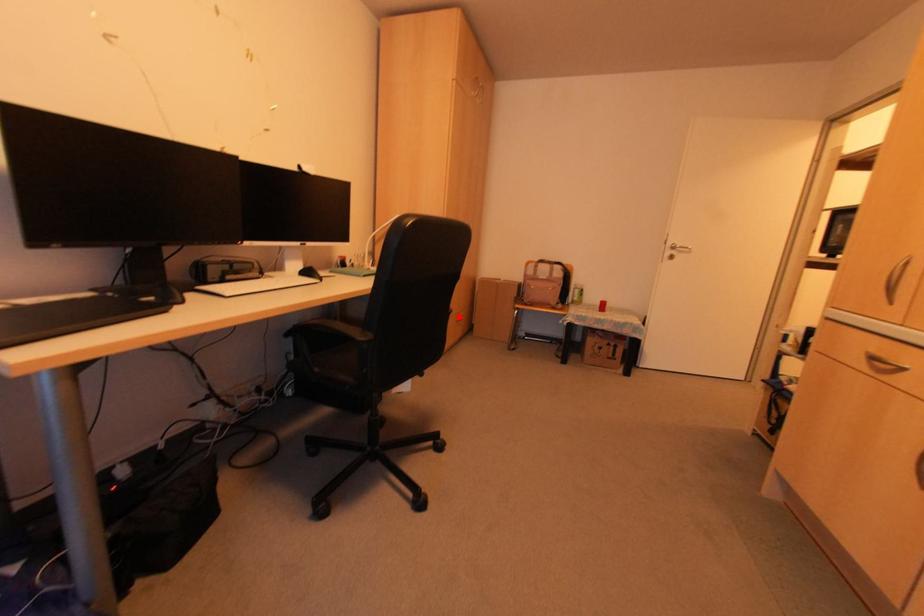
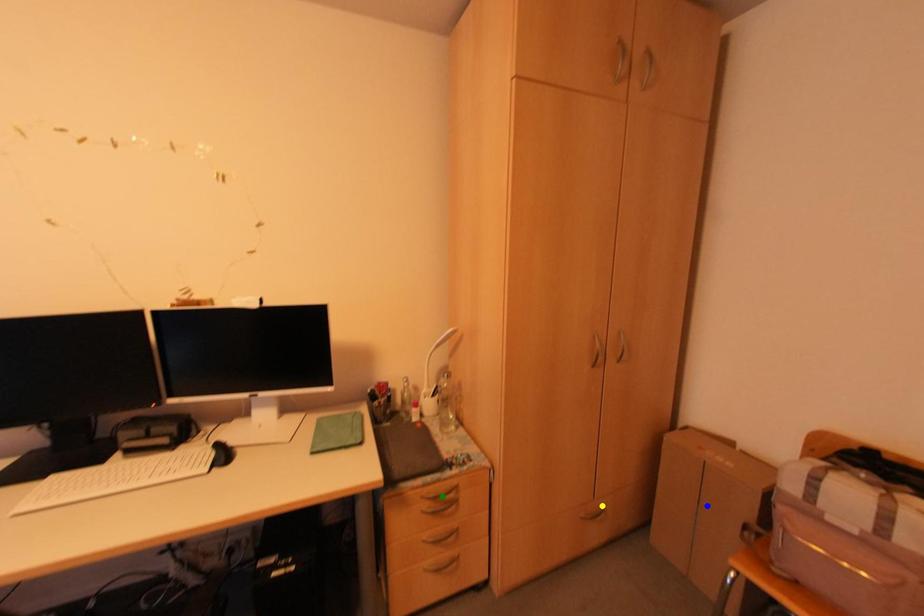
Question: I am providing you with two images of the same scene from different viewpoints. A red point is marked on the first image. You are given multiple points on the second image. Which point in image 2 represents the same 3d spot as the red point in image 1?

Choices:
 (A) yellow point
 (B) green point
 (C) blue point

Answer: (A)